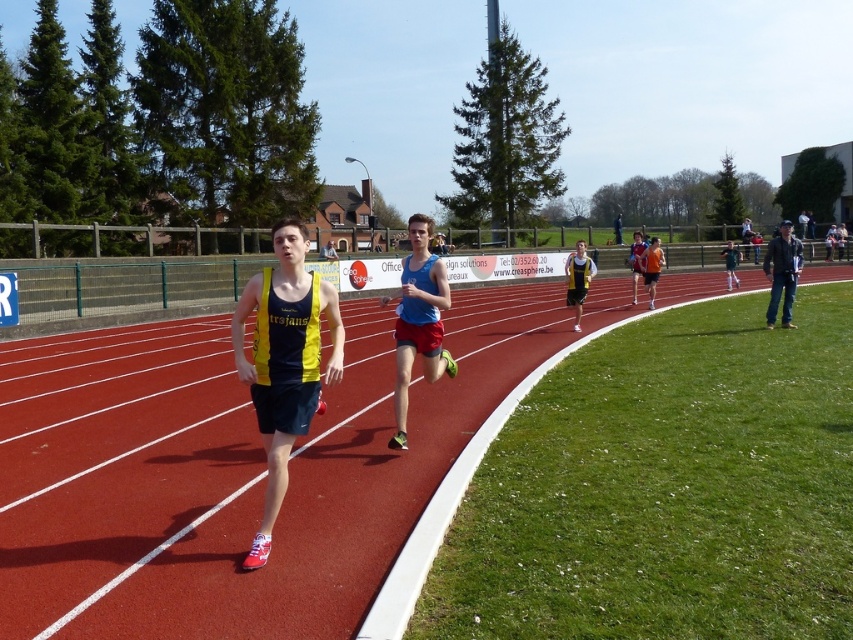
Between dark blue leather jacket at right and green matte shorts at center, which one appears on the left side from the viewer's perspective?

dark blue leather jacket at right

Between dark blue leather jacket at right and green matte shorts at center, which one is positioned higher?

green matte shorts at center

Between point (764, 259) and point (730, 269), which one is positioned behind?

The point (730, 269) is behind.

The image size is (853, 640). I want to click on dark blue leather jacket at right, so click(x=782, y=273).

From the picture: Which of these two, rubberized red track at center or blue fabric tank top at center, stands shorter?

rubberized red track at center

The height and width of the screenshot is (640, 853). What are the coordinates of `rubberized red track at center` in the screenshot? It's located at (228, 474).

Who is more forward, (498, 378) or (393, 440)?

Point (393, 440)

I want to click on rubberized red track at center, so click(x=228, y=474).

Measure the distance between point [252,564] and camera.

Point [252,564] and camera are 4.72 meters apart.

Does yellow and blue athletic top at center appear on the right side of blue fabric tank top at center?

In fact, yellow and blue athletic top at center is to the left of blue fabric tank top at center.

Based on the photo, who is more distant from viewer, (309, 276) or (433, 298)?

The point (433, 298) is behind.

Find the location of a particular element. yellow and blue athletic top at center is located at coordinates click(x=283, y=360).